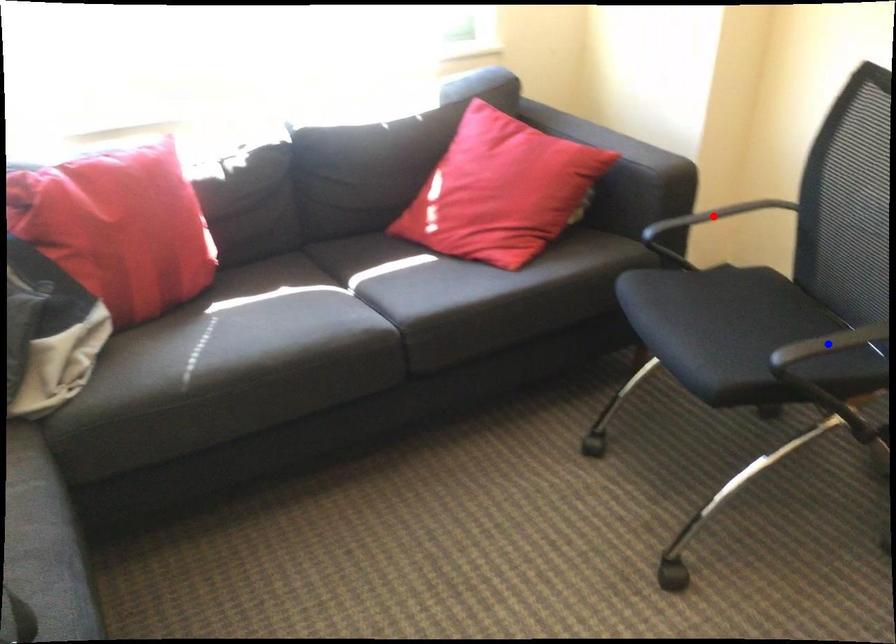
Question: In the image, two points are highlighted. Which point is nearer to the camera? Reply with the corresponding letter.

Choices:
 (A) blue point
 (B) red point

Answer: (A)